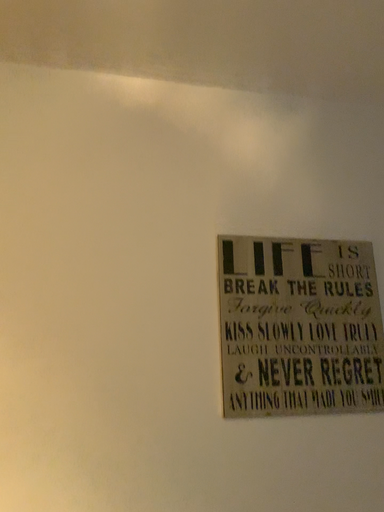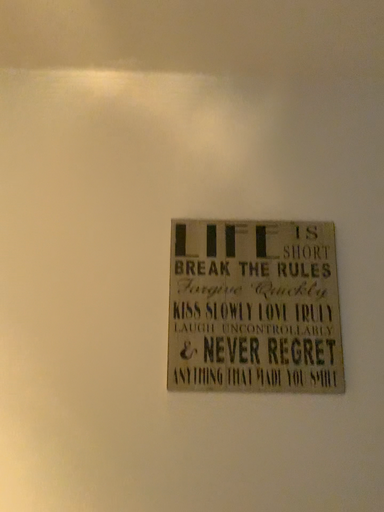
Question: How did the camera likely rotate when shooting the video?

Choices:
 (A) rotated left
 (B) rotated right

Answer: (A)